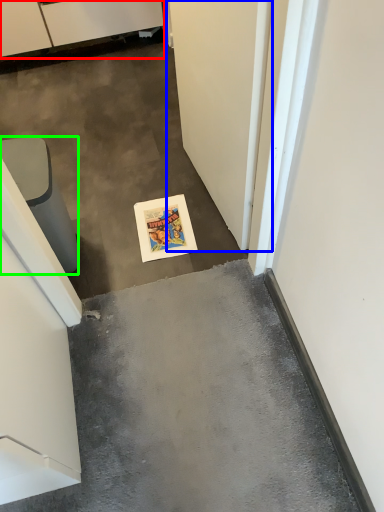
Question: Which is farther away from cabinetry (highlighted by a red box)? door (highlighted by a blue box) or furniture (highlighted by a green box)?

Choices:
 (A) door
 (B) furniture

Answer: (A)